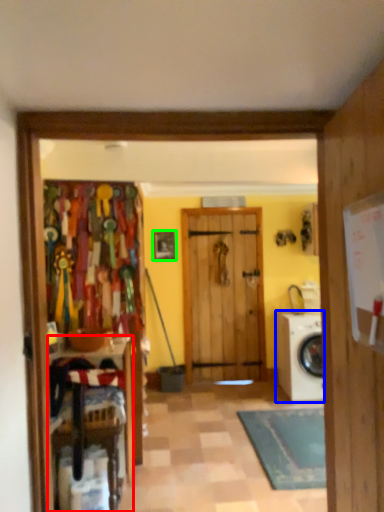
Question: Considering the real-world distances, which object is closest to furniture (highlighted by a red box)? washing machine (highlighted by a blue box) or picture frame (highlighted by a green box).

Choices:
 (A) washing machine
 (B) picture frame

Answer: (A)